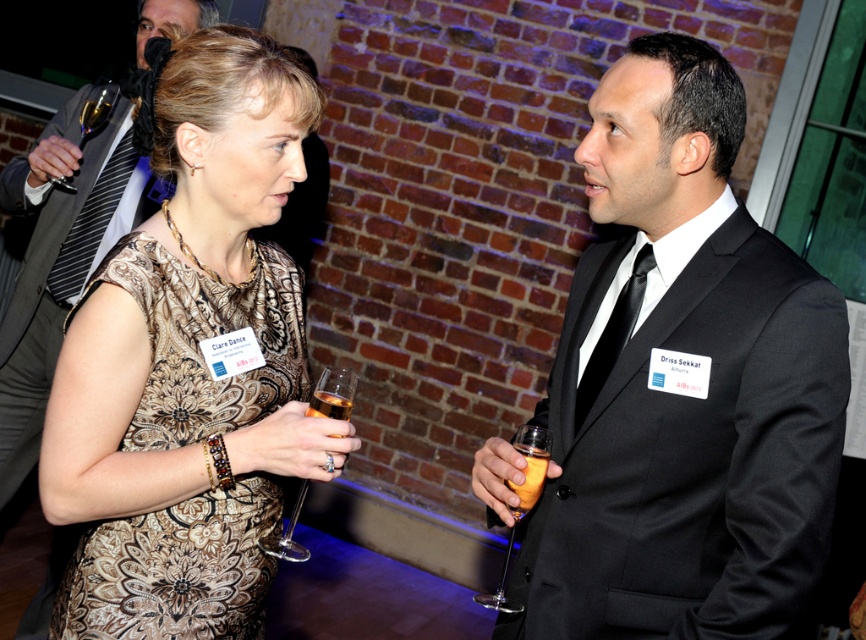
Question: In this image, where is clear glass wine glass at upper left located relative to amber liquid glass at center?

Choices:
 (A) above
 (B) below

Answer: (A)

Question: Which point appears farthest from the camera in this image?

Choices:
 (A) (534, 467)
 (B) (259, 248)
 (C) (317, 394)
 (D) (99, 86)

Answer: (D)

Question: Based on their relative distances, which object is farther from the orange plastic cup at right?

Choices:
 (A) clear glass wine glass at center
 (B) translucent glass at right
 (C) amber liquid glass at center

Answer: (A)

Question: Is clear glass wine glass at upper left to the right of translucent glass at center from the viewer's perspective?

Choices:
 (A) no
 (B) yes

Answer: (A)

Question: Which point appears closest to the camera in this image?

Choices:
 (A) (169, 420)
 (B) (327, 401)
 (C) (328, 392)
 (D) (347, 392)

Answer: (A)

Question: Does brown floral-patterned dress at center come in front of translucent glass at right?

Choices:
 (A) no
 (B) yes

Answer: (B)